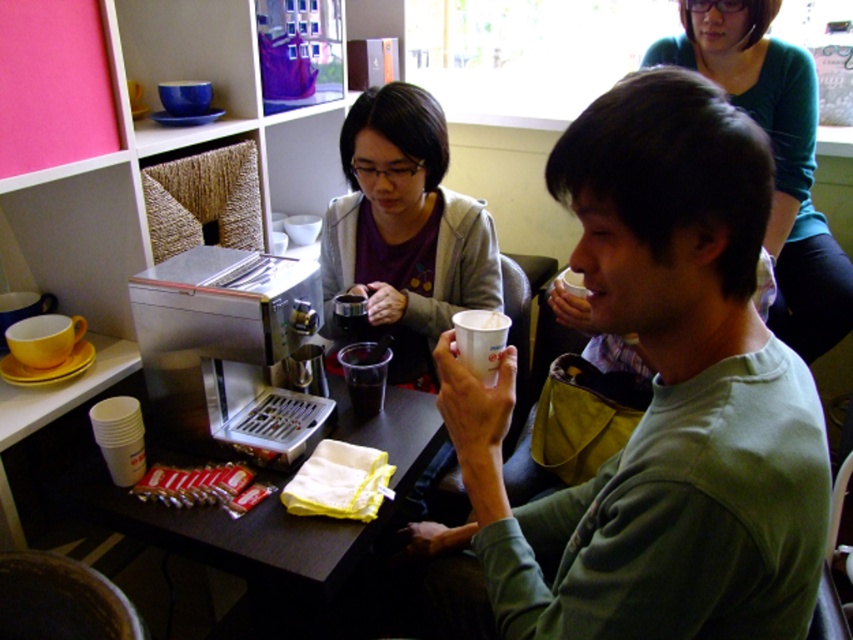
Question: Is stainless steel coffee machine at lower left thinner than green matte shirt at upper right?

Choices:
 (A) yes
 (B) no

Answer: (A)

Question: Estimate the real-world distances between objects in this image. Which object is farther from the green matte shirt at upper right?

Choices:
 (A) matte black coffee pot at center
 (B) white paper cup at center
 (C) transparent plastic cup at center

Answer: (B)

Question: Is white paper cup at center positioned before matte black coffee pot at center?

Choices:
 (A) no
 (B) yes

Answer: (B)

Question: Can you confirm if green matte shirt at upper right is positioned to the left of yellow matte cup at left?

Choices:
 (A) yes
 (B) no

Answer: (B)

Question: Among these objects, which one is farthest from the camera?

Choices:
 (A) matte black coffee pot at center
 (B) stainless steel coffee machine at lower left
 (C) white paper cup at center
 (D) green matte shirt at upper right

Answer: (D)

Question: Which point is farther to the camera?

Choices:
 (A) yellow matte cup at left
 (B) stainless steel coffee machine at lower left
 (C) transparent plastic cup at center

Answer: (C)